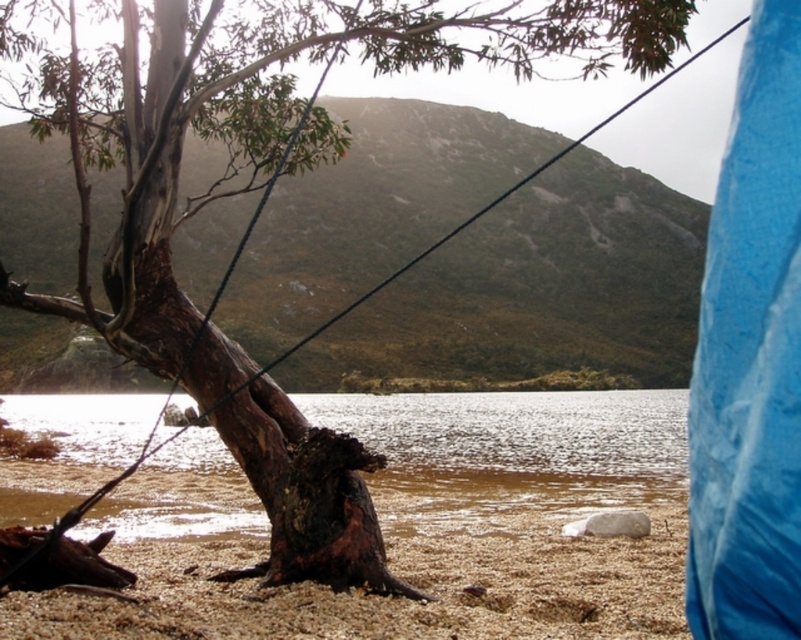
Question: Which point is closer to the camera?

Choices:
 (A) brown/muddy water at center
 (B) brown sandy beach at lower center

Answer: (B)

Question: Which of the following is the closest to the observer?

Choices:
 (A) brown sandy beach at lower center
 (B) brown/muddy water at center

Answer: (A)

Question: Among these points, which one is nearest to the camera?

Choices:
 (A) coord(634,440)
 (B) coord(300,612)

Answer: (B)

Question: Does brown/muddy water at center appear on the left side of brown sandy beach at lower center?

Choices:
 (A) yes
 (B) no

Answer: (A)

Question: Is brown/muddy water at center to the left of brown sandy beach at lower center from the viewer's perspective?

Choices:
 (A) yes
 (B) no

Answer: (A)

Question: Can you confirm if brown/muddy water at center is smaller than brown sandy beach at lower center?

Choices:
 (A) yes
 (B) no

Answer: (B)